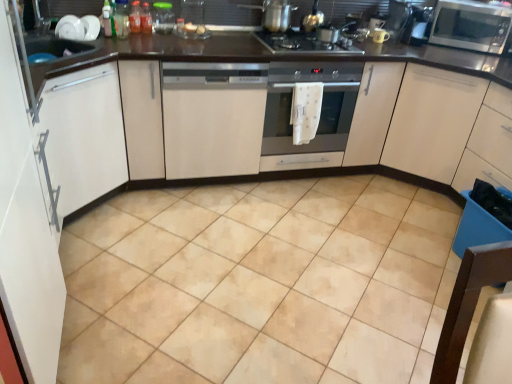
This screenshot has width=512, height=384. I want to click on free space to the left of matte ceramic mug at upper center, the first appliance from the right, so click(x=359, y=41).